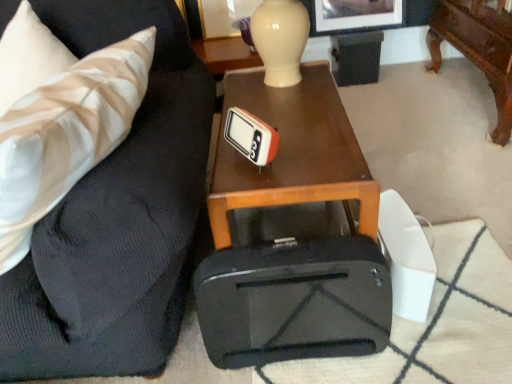
Image resolution: width=512 pixels, height=384 pixels. In order to click on vacant position to the left of white plastic thermometer at center in this screenshot , I will do `click(222, 168)`.